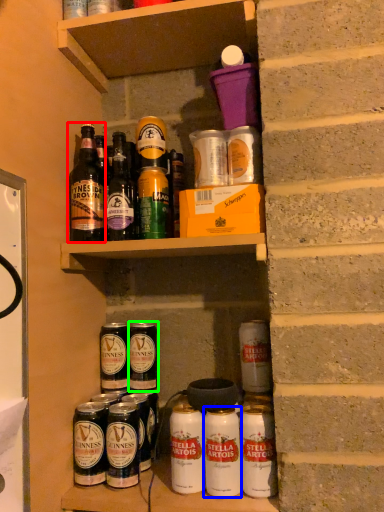
Question: Which object is positioned closest to bottle (highlighted by a red box)? Select from yoghurt (highlighted by a blue box) and beer (highlighted by a green box).

Choices:
 (A) yoghurt
 (B) beer

Answer: (B)